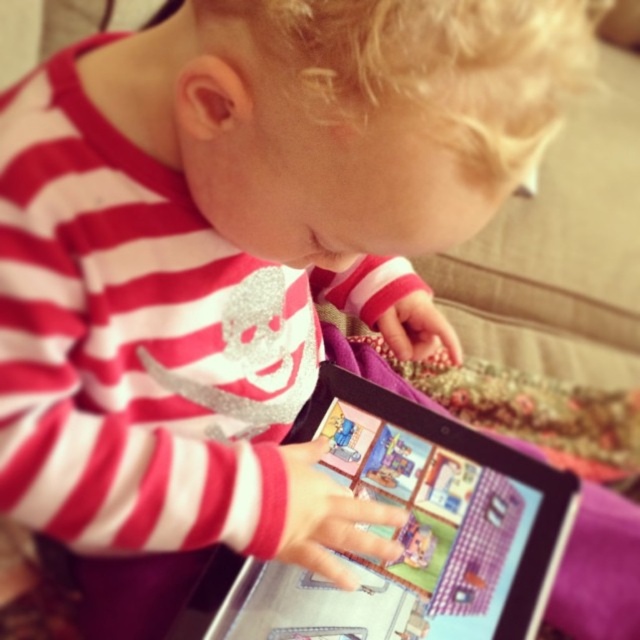
Does point (396, 417) come closer to viewer compared to point (486, 602)?

No, (396, 417) is further to viewer.

Is silver metallic tablet at center positioned in front of matte plastic tablet at center?

Yes, silver metallic tablet at center is closer to the viewer.

Identify the location of silver metallic tablet at center. The image size is (640, 640). (410, 529).

Locate an element on the screen. silver metallic tablet at center is located at coordinates (410, 529).